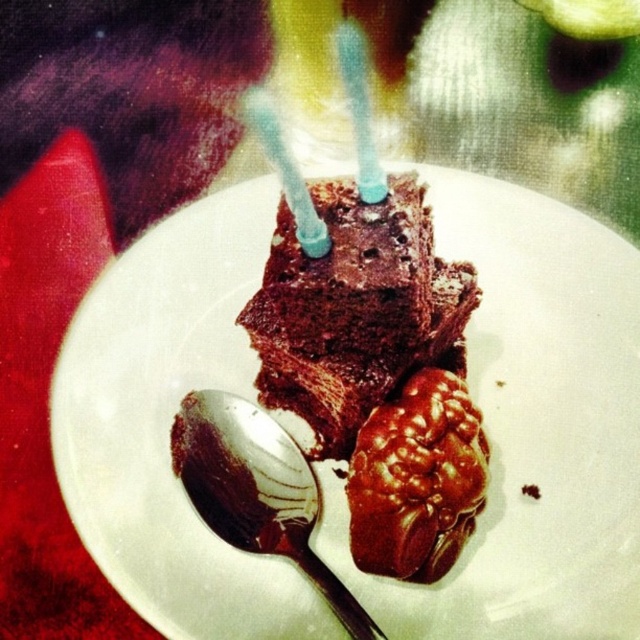
Between point (579, 540) and point (420, 566), which one is positioned in front?

Point (420, 566) is more forward.

Does chocolate cake at center have a larger size compared to shiny chocolate candy at center?

Yes, chocolate cake at center is bigger than shiny chocolate candy at center.

At what (x,y) coordinates should I click in order to perform the action: click on chocolate cake at center. Please return your answer as a coordinate pair (x, y). The height and width of the screenshot is (640, 640). Looking at the image, I should click on (531, 429).

Measure the distance between chocolate matte cake at center and shiny chocolate candy at center.

chocolate matte cake at center and shiny chocolate candy at center are 11.81 centimeters apart from each other.

Between chocolate matte cake at center and shiny chocolate candy at center, which one appears on the right side from the viewer's perspective?

From the viewer's perspective, shiny chocolate candy at center appears more on the right side.

Is point (404, 323) less distant than point (433, 424)?

No, (404, 323) is further to viewer.

Find the location of `chocolate matte cake at center`. chocolate matte cake at center is located at coordinates (355, 308).

Is point (154, 588) positioned before point (218, 490)?

Yes, point (154, 588) is in front of point (218, 490).

In the scene shown: Does chocolate cake at center appear under shiny silver spoon at lower left?

→ No.

Locate an element on the screen. The image size is (640, 640). chocolate cake at center is located at coordinates (531, 429).